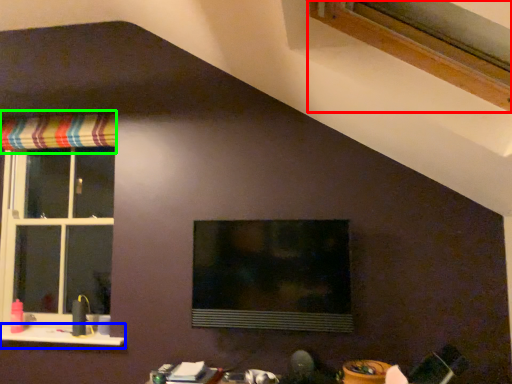
Question: Estimate the real-world distances between objects in this image. Which object is closer to window (highlighted by a red box), window sill (highlighted by a blue box) or curtain (highlighted by a green box)?

Choices:
 (A) window sill
 (B) curtain

Answer: (B)